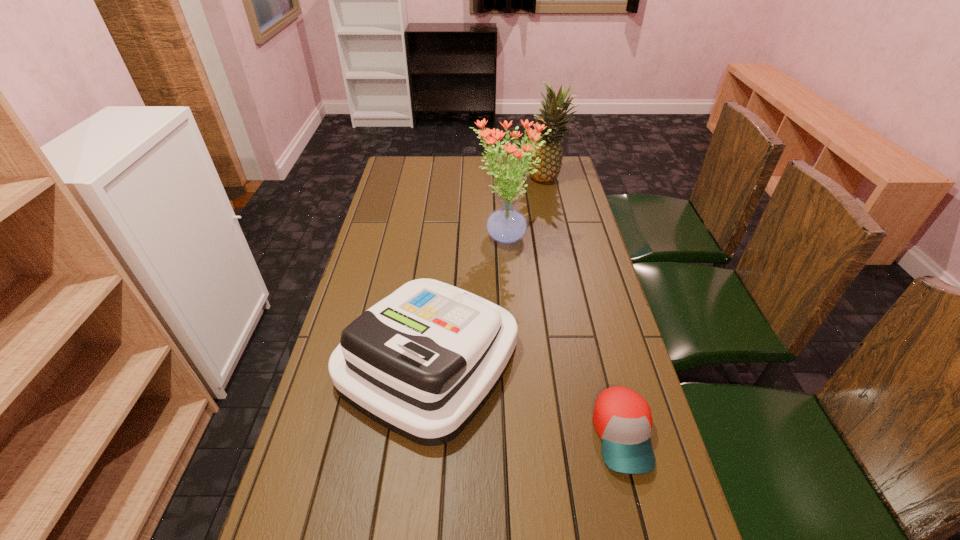
The image size is (960, 540). Identify the location of pineapple situated at the right edge. (550, 153).

The width and height of the screenshot is (960, 540). Find the location of `baseball cap that is at the right edge`. baseball cap that is at the right edge is located at coordinates (622, 418).

What are the coordinates of `object positioned at the far right corner` in the screenshot? It's located at (550, 153).

Locate an element on the screen. This screenshot has height=540, width=960. free space at the far edge is located at coordinates (535, 184).

Identify the location of vacant space at the left edge of the desktop. (337, 466).

This screenshot has width=960, height=540. I want to click on free space at the right edge of the desktop, so [x=650, y=508].

Identify the location of free point at the far left corner. (384, 183).

Identify the location of blank region between the third tallest object and the shortest object. Image resolution: width=960 pixels, height=540 pixels. (526, 397).

At what (x,y) coordinates should I click in order to perform the action: click on vacant area that lies between the farthest object and the flower arrangement. Please return your answer as a coordinate pair (x, y). The image size is (960, 540). Looking at the image, I should click on (527, 209).

Locate an element on the screen. Image resolution: width=960 pixels, height=540 pixels. free space between the cash register and the baseball cap is located at coordinates (526, 397).